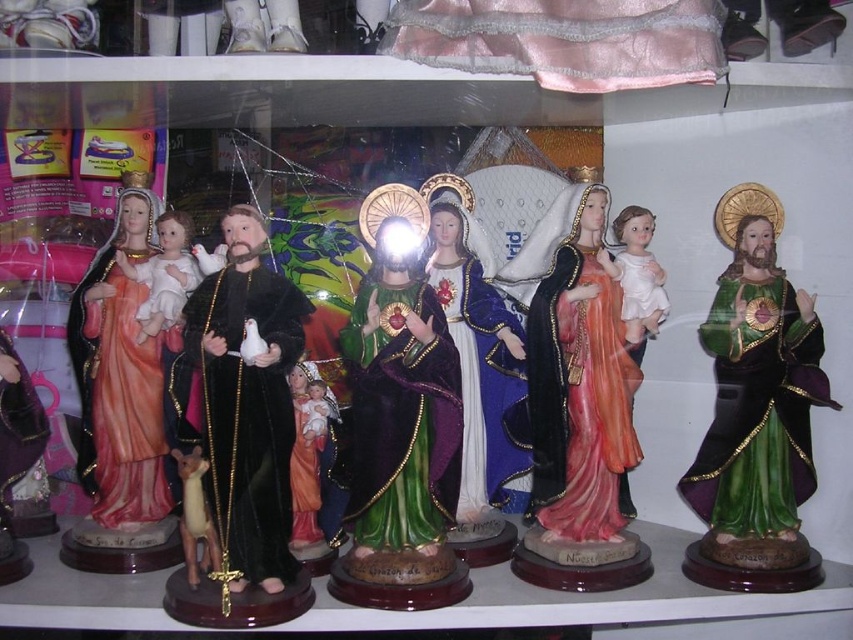
You are standing in front of a shelf with religious figurines. You notice two points marked on the shelf at coordinates point (432,372) and point (553,419). Which point is closer to you?

Point (432,372) is in front of point (553,419), so it is closer to you.

You are standing in front of the shelf with religious figurines. You notice two points marked on the shelf at coordinates point (735, 227) and point (224, 240). If you want to place a small decoration between them, which point is closer to you where you should start placing the decoration?

Point (224, 240) is closer to you than point (735, 227), so you should start placing the decoration near point (224, 240) first.